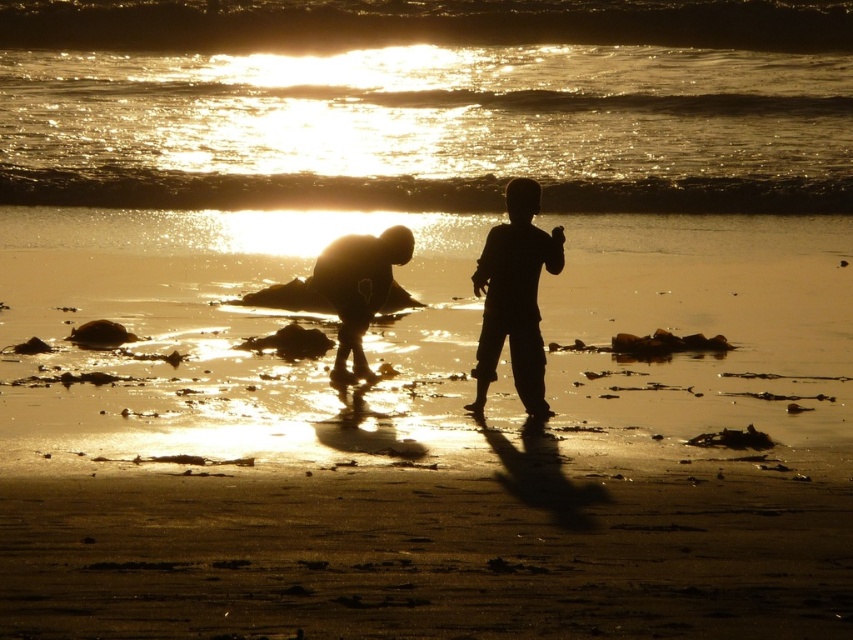
Question: Considering the relative positions of glistening golden water at upper center and silhouette figure at center in the image provided, where is glistening golden water at upper center located with respect to silhouette figure at center?

Choices:
 (A) left
 (B) right

Answer: (A)

Question: Is glistening golden water at upper center above silhouette sand at lower center?

Choices:
 (A) yes
 (B) no

Answer: (A)

Question: Among these objects, which one is farthest from the camera?

Choices:
 (A) sandy beach at center
 (B) silhouette sand at lower center

Answer: (B)

Question: Is glistening golden water at upper center thinner than silhouette sand at lower center?

Choices:
 (A) yes
 (B) no

Answer: (B)

Question: Which of the following is the farthest from the observer?

Choices:
 (A) (534, 480)
 (B) (555, 45)
 (C) (520, 257)

Answer: (B)

Question: Estimate the real-world distances between objects in this image. Which object is farther from the sandy beach at center?

Choices:
 (A) glistening golden water at upper center
 (B) silhouette sand at lower center

Answer: (A)